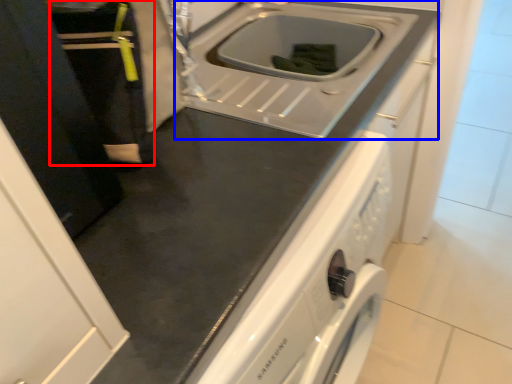
Question: Which of the following is the closest to the observer, person (highlighted by a red box) or sink (highlighted by a blue box)?

Choices:
 (A) person
 (B) sink

Answer: (A)